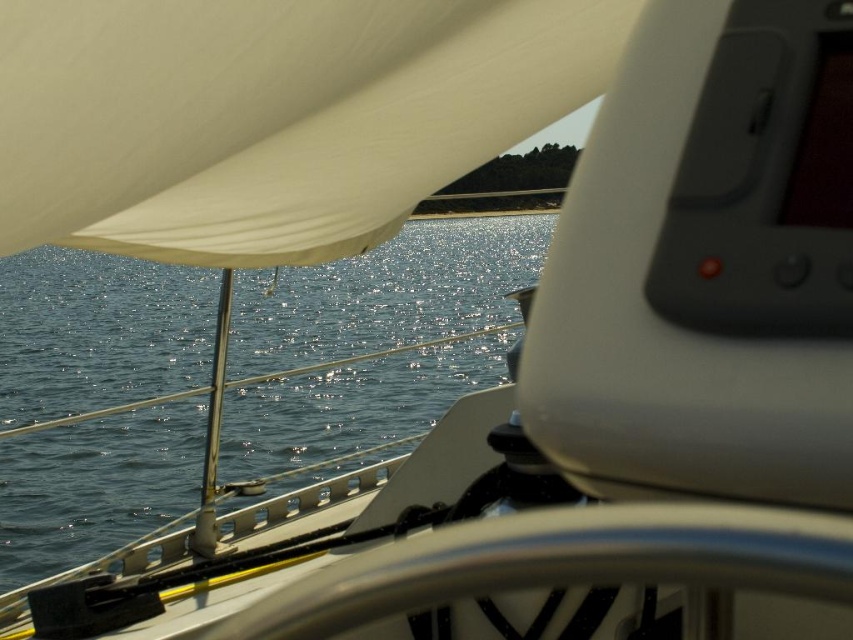
Question: Among these objects, which one is nearest to the camera?

Choices:
 (A) white matte sail at upper left
 (B) glistening blue water at center

Answer: (A)

Question: Is white matte sail at upper left to the right of glistening blue water at center from the viewer's perspective?

Choices:
 (A) no
 (B) yes

Answer: (B)

Question: Does white matte sail at upper left appear on the left side of glistening blue water at center?

Choices:
 (A) no
 (B) yes

Answer: (A)

Question: Which point appears farthest from the camera in this image?

Choices:
 (A) (326, 228)
 (B) (421, 312)

Answer: (B)

Question: Which object is farther from the camera taking this photo?

Choices:
 (A) glistening blue water at center
 (B) white matte sail at upper left

Answer: (A)

Question: Observing the image, what is the correct spatial positioning of white matte sail at upper left in reference to glistening blue water at center?

Choices:
 (A) right
 (B) left

Answer: (A)